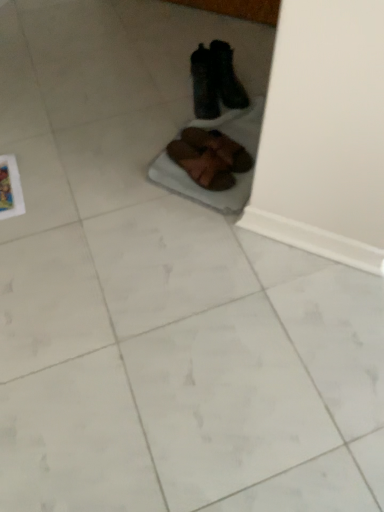
Question: Is black leather boots at upper center, positioned as the first footwear in top-to-bottom order, bigger than brown suede shoes at center, which ranks as the third footwear in top-to-bottom order?

Choices:
 (A) yes
 (B) no

Answer: (A)

Question: From the image's perspective, is black leather boots at upper center, positioned as the first footwear in top-to-bottom order, beneath brown suede shoes at center, which ranks as the third footwear in top-to-bottom order?

Choices:
 (A) no
 (B) yes

Answer: (A)

Question: Can brown suede shoes at center, which ranks as the third footwear in top-to-bottom order, be found inside black leather boots at upper center, which ranks as the fourth footwear in bottom-to-top order?

Choices:
 (A) yes
 (B) no

Answer: (B)

Question: From a real-world perspective, does black leather boots at upper center, which ranks as the fourth footwear in bottom-to-top order, sit lower than brown suede shoes at center, which ranks as the third footwear in top-to-bottom order?

Choices:
 (A) yes
 (B) no

Answer: (B)

Question: Does black leather boots at upper center, positioned as the first footwear in top-to-bottom order, have a lesser height compared to brown suede shoes at center, marked as the second footwear in a bottom-to-top arrangement?

Choices:
 (A) yes
 (B) no

Answer: (B)

Question: From the image's perspective, is black leather boots at upper center, positioned as the first footwear in top-to-bottom order, positioned above or below black fuzzy slippers at center, positioned as the 2th footwear in top-to-bottom order?

Choices:
 (A) above
 (B) below

Answer: (A)

Question: From a real-world perspective, is black leather boots at upper center, positioned as the first footwear in top-to-bottom order, above or below black fuzzy slippers at center, positioned as the 2th footwear in top-to-bottom order?

Choices:
 (A) above
 (B) below

Answer: (B)

Question: Is black leather boots at upper center, which ranks as the fourth footwear in bottom-to-top order, to the left or to the right of black fuzzy slippers at center, which ranks as the third footwear in bottom-to-top order, in the image?

Choices:
 (A) left
 (B) right

Answer: (B)

Question: Looking at their shapes, would you say black leather boots at upper center, which ranks as the fourth footwear in bottom-to-top order, is wider or thinner than black fuzzy slippers at center, which ranks as the third footwear in bottom-to-top order?

Choices:
 (A) thin
 (B) wide

Answer: (A)

Question: Relative to black leather boots at upper center, positioned as the first footwear in top-to-bottom order, is brown suede shoes at center, the first footwear from the bottom, in front or behind?

Choices:
 (A) front
 (B) behind

Answer: (A)

Question: In terms of height, does brown suede shoes at center, placed as the 4th footwear when sorted from top to bottom, look taller or shorter compared to black leather boots at upper center, which ranks as the fourth footwear in bottom-to-top order?

Choices:
 (A) short
 (B) tall

Answer: (A)

Question: Considering the positions of point (173, 159) and point (210, 53), is point (173, 159) closer or farther from the camera than point (210, 53)?

Choices:
 (A) farther
 (B) closer

Answer: (B)

Question: Considering the relative positions of brown suede shoes at center, placed as the 4th footwear when sorted from top to bottom, and black leather boots at upper center, which ranks as the fourth footwear in bottom-to-top order, in the image provided, is brown suede shoes at center, placed as the 4th footwear when sorted from top to bottom, to the left or to the right of black leather boots at upper center, which ranks as the fourth footwear in bottom-to-top order,?

Choices:
 (A) left
 (B) right

Answer: (A)

Question: From the image's perspective, is black fuzzy slippers at center, which ranks as the third footwear in bottom-to-top order, positioned above or below brown suede shoes at center, marked as the second footwear in a bottom-to-top arrangement?

Choices:
 (A) below
 (B) above

Answer: (B)

Question: From a real-world perspective, is black fuzzy slippers at center, positioned as the 2th footwear in top-to-bottom order, physically located above or below brown suede shoes at center, marked as the second footwear in a bottom-to-top arrangement?

Choices:
 (A) below
 (B) above

Answer: (B)